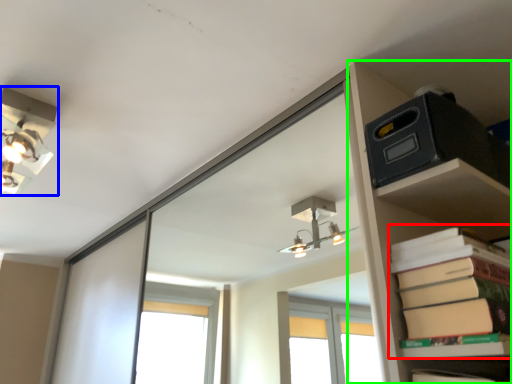
Question: Based on their relative distances, which object is nearer to paperback book (highlighted by a red box)? Choose from lamp (highlighted by a blue box) and shelf (highlighted by a green box).

Choices:
 (A) lamp
 (B) shelf

Answer: (B)